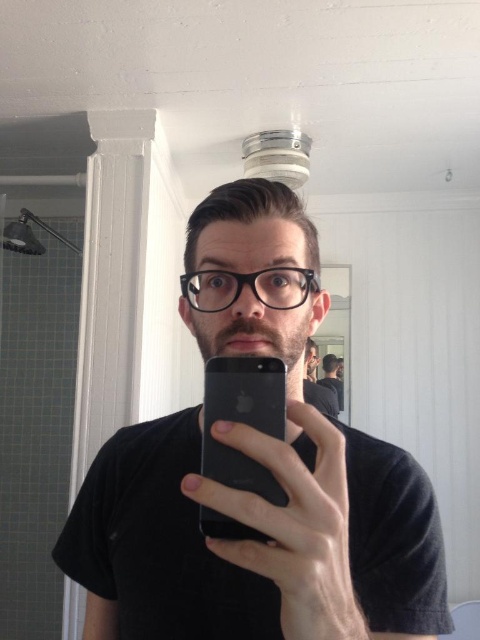
Question: Which object appears farthest from the camera in this image?

Choices:
 (A) black matte shirt at center
 (B) matte black phone at center

Answer: (A)

Question: Which point appears farthest from the camera in this image?

Choices:
 (A) (335, 392)
 (B) (284, 429)

Answer: (A)

Question: Is black matte smartphone at center wider than black matte shirt at center?

Choices:
 (A) no
 (B) yes

Answer: (A)

Question: Considering the real-world distances, which object is closest to the black matte shirt at center?

Choices:
 (A) matte black phone at center
 (B) black matte smartphone at center

Answer: (A)

Question: Considering the relative positions of matte black phone at center and black matte smartphone at center in the image provided, where is matte black phone at center located with respect to black matte smartphone at center?

Choices:
 (A) left
 (B) right

Answer: (B)

Question: Does black matte smartphone at center have a smaller size compared to black matte shirt at center?

Choices:
 (A) no
 (B) yes

Answer: (B)